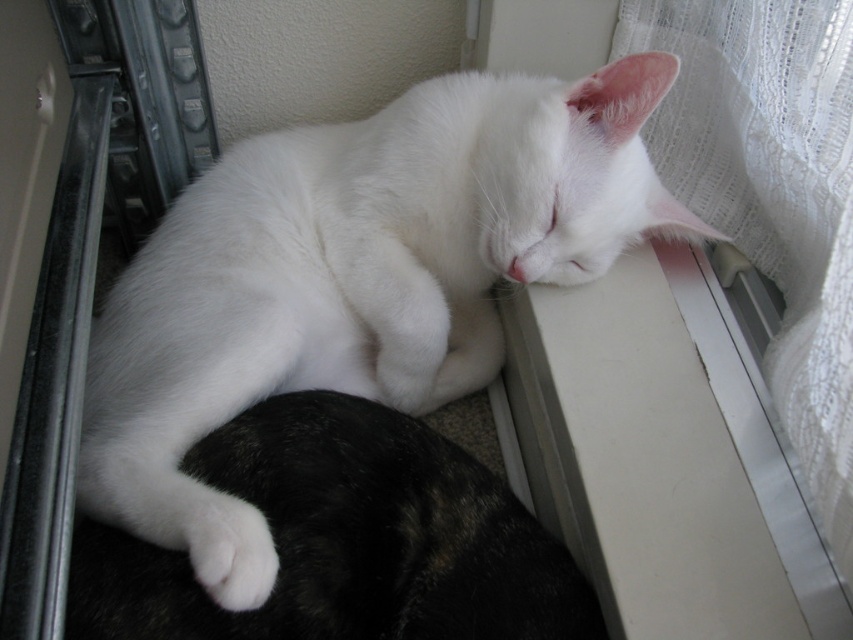
You are a photographer trying to capture both the white fluffy cat at upper center and the white lace curtain at upper right in a single frame. Based on their positions and sizes, do you think you can fit both into the camera view without moving the camera?

The white fluffy cat at upper center might be wider than white lace curtain at upper right, so it is uncertain if both can fit into the frame without moving the camera. Adjust the camera angle or zoom to ensure both are visible.

You are a photographer trying to capture both the white fluffy cat at upper center and the white lace curtain at upper right in the same frame. Based on their sizes, will the cat appear smaller than the curtain in the photo?

The white fluffy cat at upper center is shorter than the white lace curtain at upper right, so yes, the cat will appear smaller than the curtain in the photo.